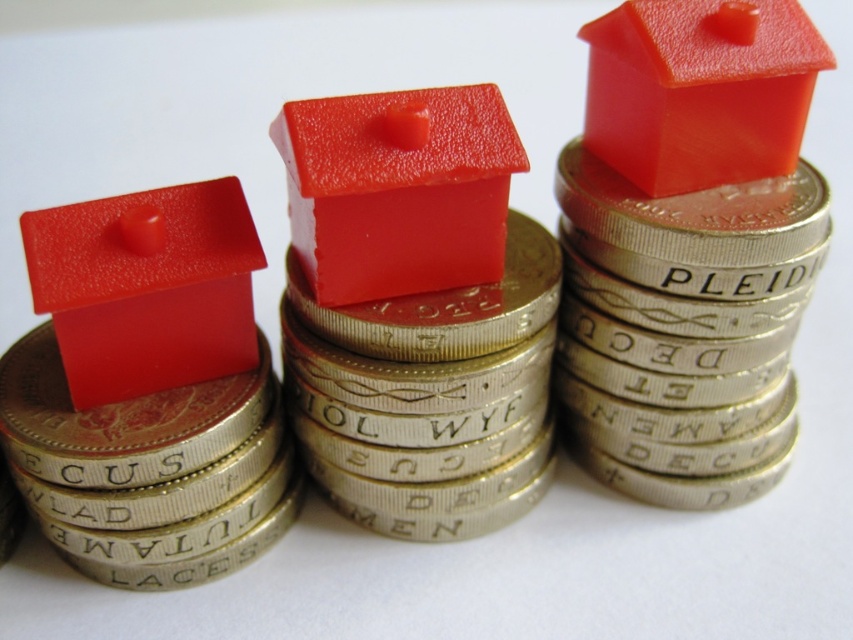
Does matte gold coin at left have a smaller size compared to glossy plastic house at center?

Yes, matte gold coin at left is smaller than glossy plastic house at center.

Which is in front, point (96, 483) or point (550, 307)?

Point (96, 483) is more forward.

The height and width of the screenshot is (640, 853). In order to click on matte gold coin at left in this screenshot , I will do `click(120, 420)`.

Find the location of a particular element. The height and width of the screenshot is (640, 853). matte gold coin at left is located at coordinates (120, 420).

Who is shorter, matte plastic house at center or glossy plastic house at center?

glossy plastic house at center

The height and width of the screenshot is (640, 853). Describe the element at coordinates (398, 189) in the screenshot. I see `matte plastic house at center` at that location.

Find the location of a particular element. matte plastic house at center is located at coordinates (398, 189).

Is matte plastic house at center closer to the viewer compared to matte red house at left?

Yes, matte plastic house at center is in front of matte red house at left.

Which of these two, matte plastic house at center or matte red house at left, stands shorter?

With less height is matte plastic house at center.

Is point (343, 180) behind point (51, 253)?

That is False.

Image resolution: width=853 pixels, height=640 pixels. What are the coordinates of `matte plastic house at center` in the screenshot? It's located at (398, 189).